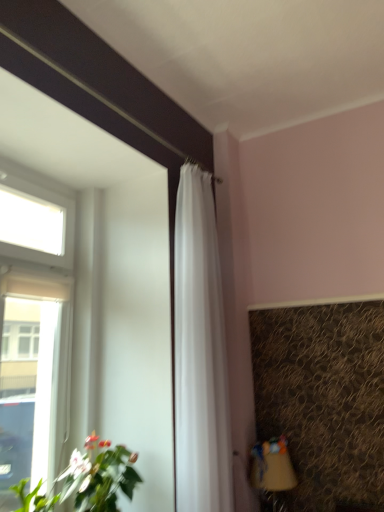
Question: From a real-world perspective, is white sheer curtain at center located higher than matte brown table lamp at lower right?

Choices:
 (A) yes
 (B) no

Answer: (A)

Question: Is white sheer curtain at center bigger than matte brown table lamp at lower right?

Choices:
 (A) no
 (B) yes

Answer: (B)

Question: Does white sheer curtain at center have a lesser width compared to matte brown table lamp at lower right?

Choices:
 (A) yes
 (B) no

Answer: (A)

Question: Is white sheer curtain at center surrounding matte brown table lamp at lower right?

Choices:
 (A) no
 (B) yes

Answer: (A)

Question: Could you tell me if white sheer curtain at center is facing matte brown table lamp at lower right?

Choices:
 (A) yes
 (B) no

Answer: (B)

Question: Considering the relative sizes of white sheer curtain at center and matte brown table lamp at lower right in the image provided, is white sheer curtain at center taller than matte brown table lamp at lower right?

Choices:
 (A) no
 (B) yes

Answer: (B)

Question: Is matte brown table lamp at lower right in front of white sheer curtain at center?

Choices:
 (A) no
 (B) yes

Answer: (A)

Question: Can you confirm if matte brown table lamp at lower right is shorter than white sheer curtain at center?

Choices:
 (A) no
 (B) yes

Answer: (B)

Question: Is matte brown table lamp at lower right positioned beyond the bounds of white sheer curtain at center?

Choices:
 (A) yes
 (B) no

Answer: (A)

Question: From a real-world perspective, is matte brown table lamp at lower right below white sheer curtain at center?

Choices:
 (A) yes
 (B) no

Answer: (A)

Question: Considering the relative sizes of matte brown table lamp at lower right and white sheer curtain at center in the image provided, is matte brown table lamp at lower right bigger than white sheer curtain at center?

Choices:
 (A) yes
 (B) no

Answer: (B)

Question: Is matte brown table lamp at lower right thinner than white sheer curtain at center?

Choices:
 (A) no
 (B) yes

Answer: (A)

Question: Considering the relative sizes of transparent glass window at upper left and matte brown table lamp at lower right in the image provided, is transparent glass window at upper left thinner than matte brown table lamp at lower right?

Choices:
 (A) yes
 (B) no

Answer: (A)